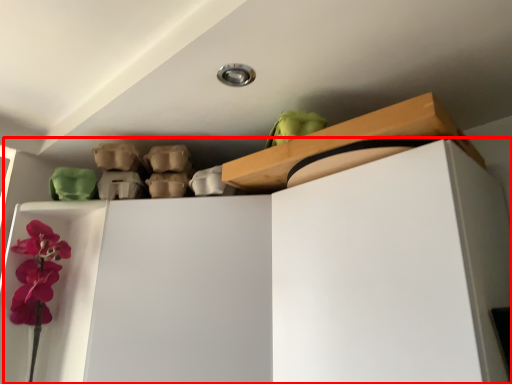
Question: Observing the image, what is the correct spatial positioning of dresser (annotated by the red box) in reference to shelf?

Choices:
 (A) right
 (B) left

Answer: (B)